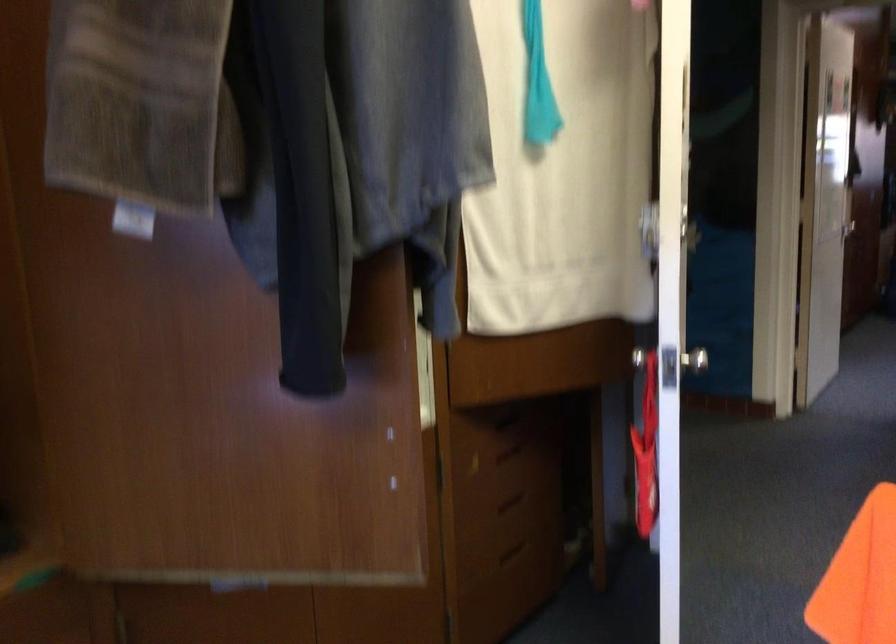
How did the camera likely rotate?

The camera rotated toward right-down.